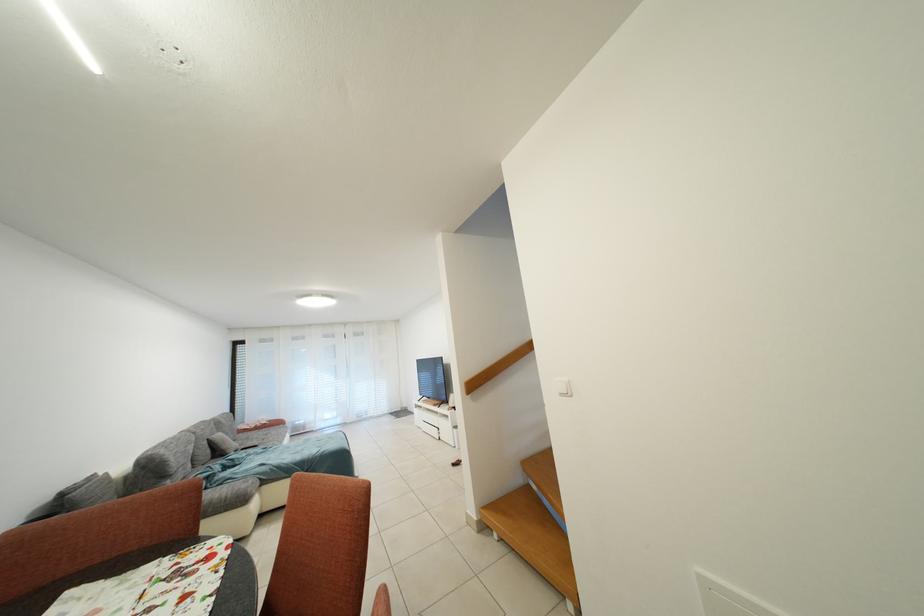
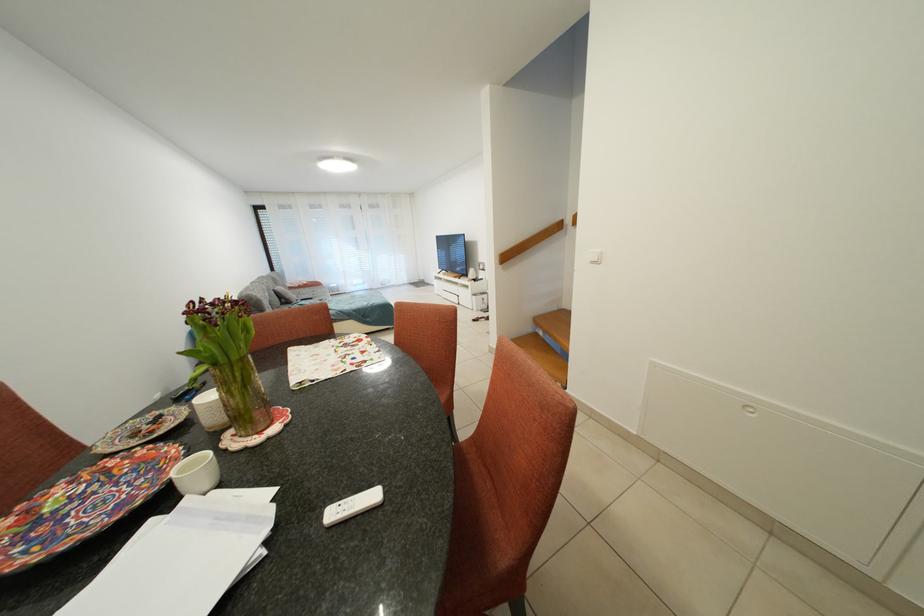
Question: I am providing you with two images of the same scene from different viewpoints. Please identify which objects are invisible in image2.

Choices:
 (A) glass flower vase
 (B) colorful decorative plate
 (C) white ceramic cup
 (D) none of these

Answer: (D)